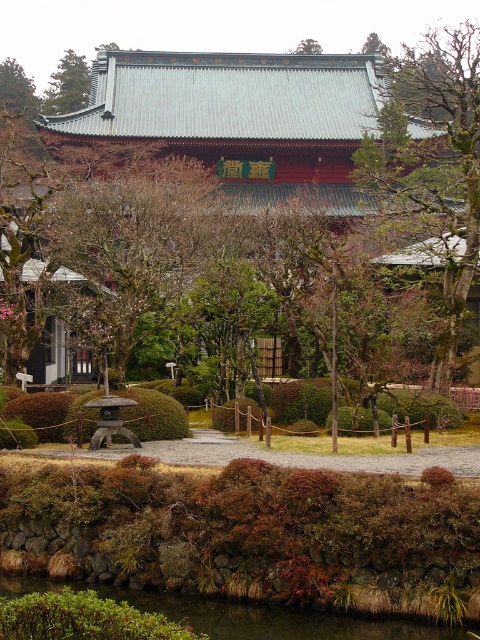
You are standing in the Japanese garden and want to take a photo. There are two points marked in the image, point 1 at coordinates point (x=373, y=637) and point 2 at coordinates point (x=51, y=90). Which point is closer to your current position?

Point (x=373, y=637) is closer to the camera than point (x=51, y=90), so point 1 is closer to your current position.

You are standing at the entrance of the temple complex and want to locate the green leafy tree at upper left. According to the coordinates provided, where exactly should you look?

The green leafy tree at upper left is located at coordinates point (x=68, y=84).